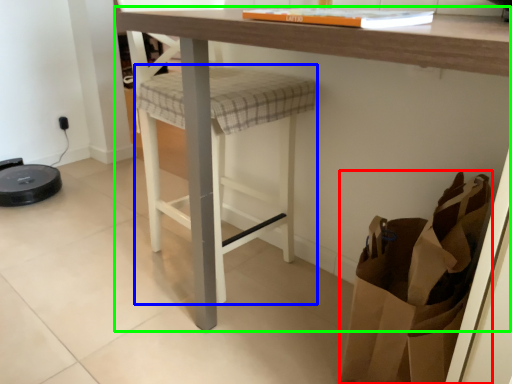
Question: Considering the real-world distances, which object is farthest from shopping bag (highlighted by a red box)? step stool (highlighted by a blue box) or table (highlighted by a green box)?

Choices:
 (A) step stool
 (B) table

Answer: (A)